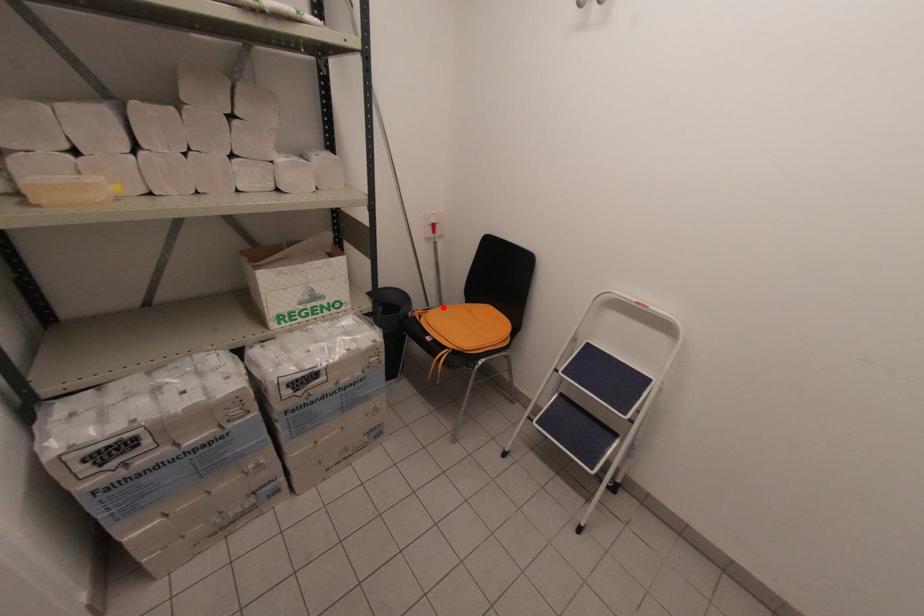
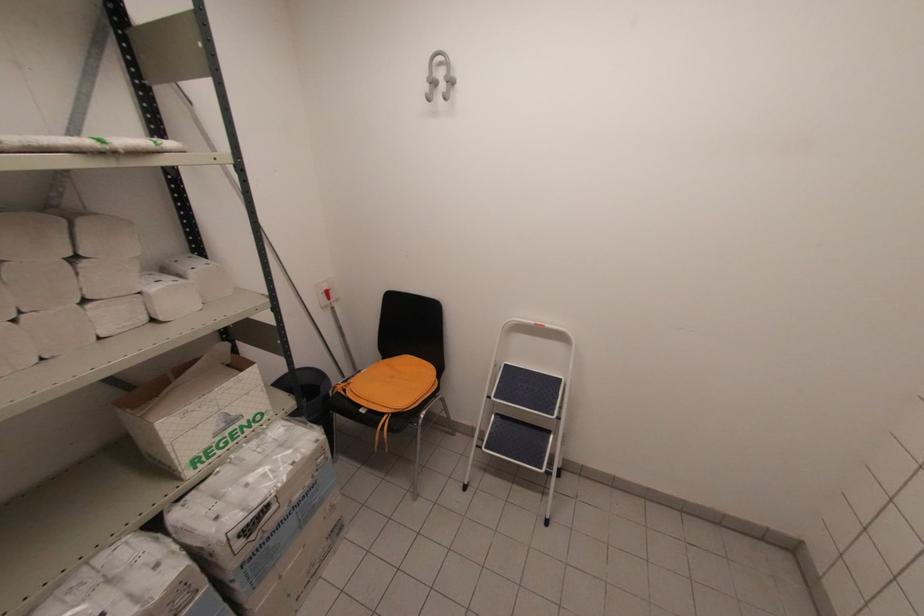
In the second image, find the point that corresponds to the highlighted location in the first image.

(362, 371)